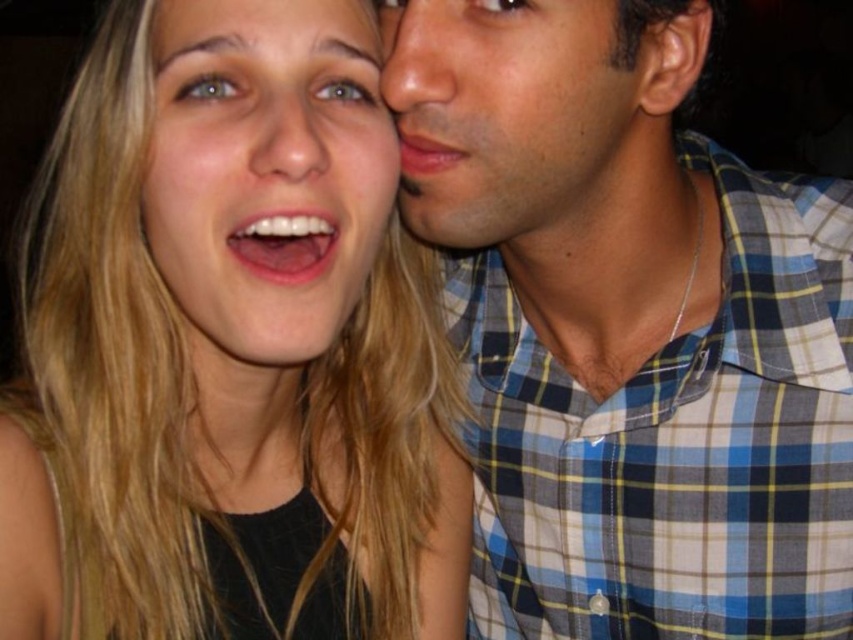
Question: Based on their relative distances, which object is nearer to the smooth skin face at upper right?

Choices:
 (A) smooth skin nose at center
 (B) matte black hair at center
 (C) matte skin forehead at upper center
 (D) matte skin nose at upper right

Answer: (D)

Question: Where is smooth skin face at center located in relation to white glossy teeth at center in the image?

Choices:
 (A) above
 (B) below

Answer: (A)

Question: Does blue plaid shirt at upper right appear on the left side of matte skin at right?

Choices:
 (A) yes
 (B) no

Answer: (B)

Question: Does smooth skin face at center lie behind matte skin forehead at upper center?

Choices:
 (A) no
 (B) yes

Answer: (A)

Question: Among these objects, which one is nearest to the camera?

Choices:
 (A) matte black hair at center
 (B) smooth skin nose at center
 (C) smooth skin face at upper right
 (D) matte skin at right

Answer: (B)

Question: Among these objects, which one is nearest to the camera?

Choices:
 (A) matte skin forehead at upper center
 (B) white glossy teeth at center
 (C) smooth skin face at upper right

Answer: (B)